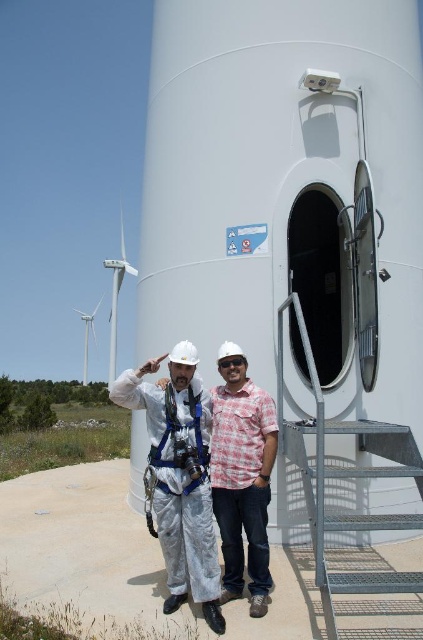
Question: Is white matte windmill at upper left above white matte windmill at left?

Choices:
 (A) yes
 (B) no

Answer: (A)

Question: Observing the image, what is the correct spatial positioning of white matte/soft fabric couple at center in reference to white matte windmill at left?

Choices:
 (A) left
 (B) right

Answer: (B)

Question: Which point is farther from the camera taking this photo?

Choices:
 (A) [128, 268]
 (B) [147, 476]
 (C) [96, 308]
 (D) [258, 486]

Answer: (C)

Question: Which object appears farthest from the camera in this image?

Choices:
 (A) white matte/soft fabric couple at center
 (B) plaid shirt at center
 (C) white matte windmill at left

Answer: (C)

Question: Does white matte/soft fabric couple at center have a greater width compared to white matte windmill at upper left?

Choices:
 (A) no
 (B) yes

Answer: (A)

Question: Which of the following is the farthest from the observer?

Choices:
 (A) white matte windmill at upper left
 (B) plaid shirt at center

Answer: (A)